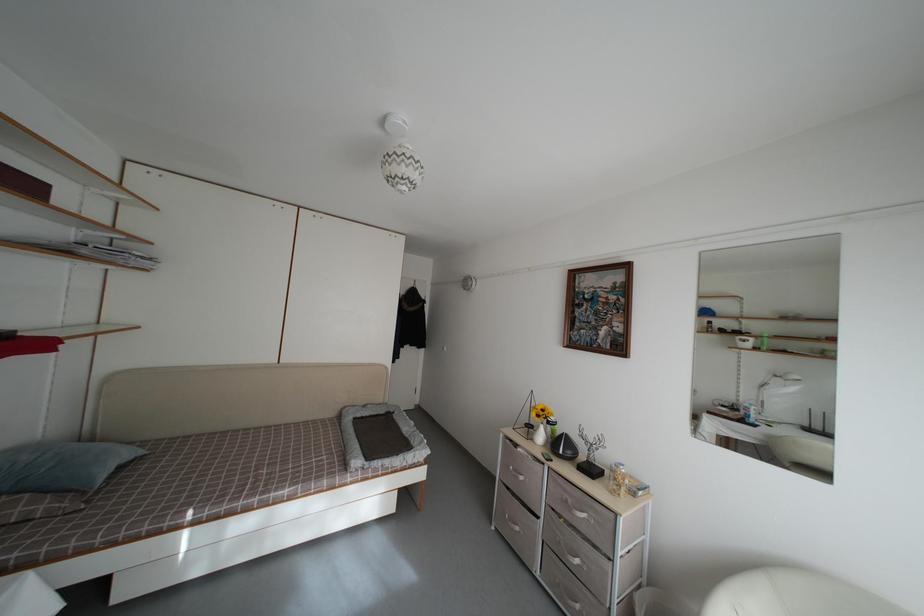
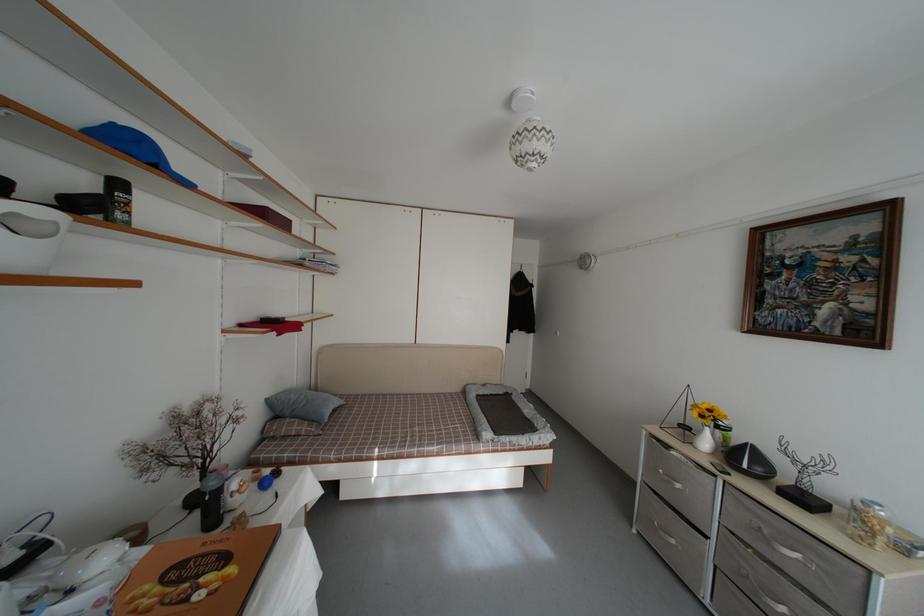
Locate, in the second image, the point that corresponds to pixel 546 443 in the first image.

(711, 448)